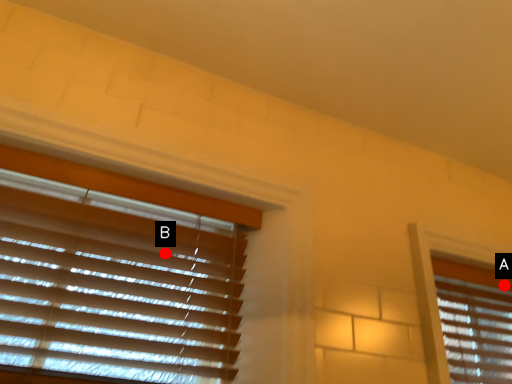
Question: Two points are circled on the image, labeled by A and B beside each circle. Which of the following is the closest to the observer?

Choices:
 (A) A is closer
 (B) B is closer

Answer: (B)